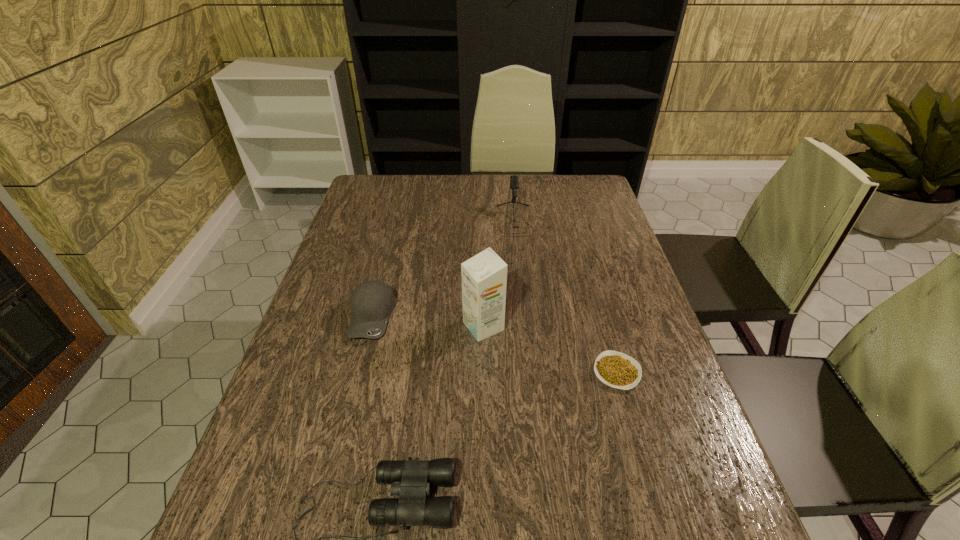
What are the coordinates of `carton` in the screenshot? It's located at (484, 276).

Where is `the farthest object`? This screenshot has height=540, width=960. the farthest object is located at coordinates (514, 182).

Identify the location of the fourth shortest object. Image resolution: width=960 pixels, height=540 pixels. (514, 182).

The width and height of the screenshot is (960, 540). Find the location of `baseball cap`. baseball cap is located at coordinates (372, 302).

Where is `the rightmost object`? the rightmost object is located at coordinates (618, 370).

Locate an element on the screen. The width and height of the screenshot is (960, 540). the fourth farthest object is located at coordinates (618, 370).

Where is `free space located on the back of the tallest object`? The height and width of the screenshot is (540, 960). free space located on the back of the tallest object is located at coordinates (483, 237).

What are the coordinates of `free space located 0.050m on the stand of the microphone` in the screenshot? It's located at (516, 247).

The height and width of the screenshot is (540, 960). In order to click on blank space located 0.140m on the front brim of the third shortest object in this screenshot , I will do `click(352, 394)`.

The image size is (960, 540). Identify the location of vacant space situated on the front of the legume. (645, 470).